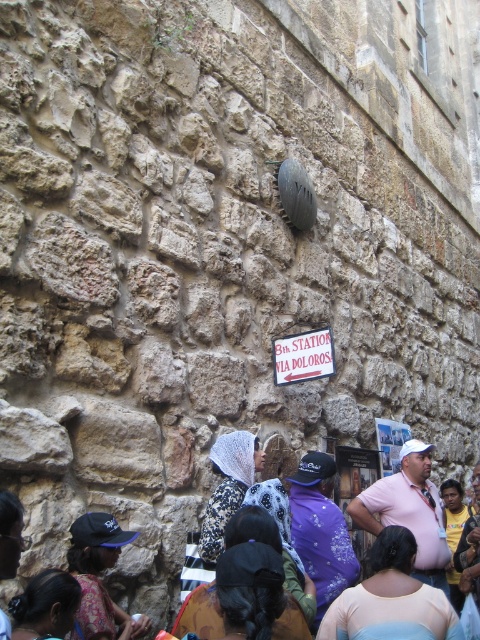
Between printed fabric headscarf at center and white paper sign at center, which one is positioned lower?

Positioned lower is printed fabric headscarf at center.

Is printed fabric headscarf at center in front of white paper sign at center?

Yes, printed fabric headscarf at center is in front of white paper sign at center.

Is point (207, 550) in front of point (278, 342)?

Yes, point (207, 550) is closer to viewer.

I want to click on printed fabric headscarf at center, so click(x=228, y=486).

Is point (352, 566) closer to camera compared to point (292, 490)?

Yes, point (352, 566) is in front of point (292, 490).

Who is positioned more to the left, black fabric headscarf at center or purple fabric at center?

purple fabric at center

At what (x,y) coordinates should I click in order to perform the action: click on black fabric headscarf at center. Please return your answer as a coordinate pair (x, y). Looking at the image, I should click on (325, 568).

Between dark brown hair at lower left and white paper sign at center, which one has less height?

With less height is dark brown hair at lower left.

Is dark brown hair at lower left to the left of white paper sign at center from the viewer's perspective?

Yes, dark brown hair at lower left is to the left of white paper sign at center.

Measure the distance between dark brown hair at lower left and camera.

The distance of dark brown hair at lower left from camera is 15.00 meters.

I want to click on dark brown hair at lower left, so click(46, 605).